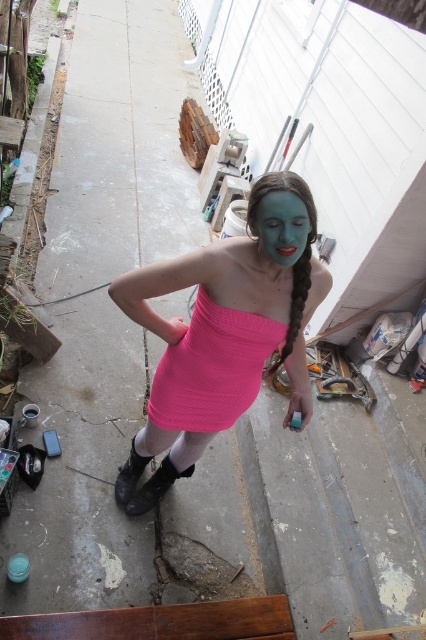
Question: Which point is closer to the camera?

Choices:
 (A) blue matte pigtail at center
 (B) pink matte dress at center
 (C) blue matte face at center

Answer: (C)

Question: Can you confirm if pink matte dress at center is bigger than pink ribbed dress at center?

Choices:
 (A) yes
 (B) no

Answer: (A)

Question: Estimate the real-world distances between objects in this image. Which object is closer to the blue matte pigtail at center?

Choices:
 (A) pink matte dress at center
 (B) pink ribbed dress at center
 (C) blue matte face at center

Answer: (C)

Question: Does pink ribbed dress at center have a smaller size compared to blue matte face at center?

Choices:
 (A) no
 (B) yes

Answer: (A)

Question: Is blue matte face at center closer to camera compared to blue matte pigtail at center?

Choices:
 (A) yes
 (B) no

Answer: (A)

Question: Among these points, which one is farthest from the camera?

Choices:
 (A) [314, 240]
 (B) [288, 257]
 (C) [229, 346]

Answer: (C)